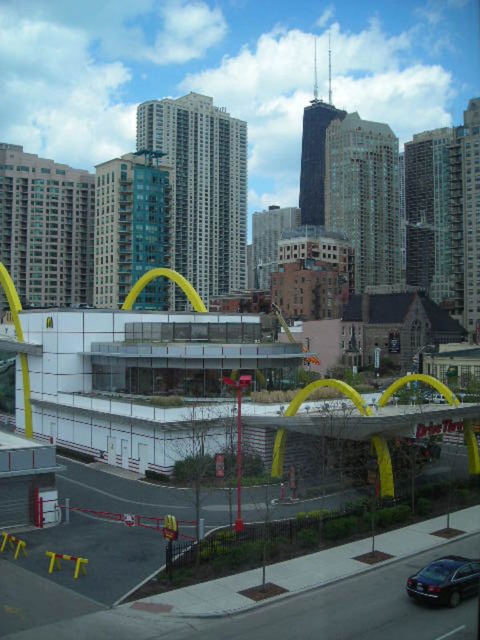
Does point (475, 586) come closer to viewer compared to point (177, 280)?

Yes, it is.

Consider the image. Which is more to the left, shiny black sedan at lower right or yellow rubber at center?

yellow rubber at center is more to the left.

Identify the location of shiny black sedan at lower right. This screenshot has height=640, width=480. (444, 580).

You are a GUI agent. You are given a task and a screenshot of the screen. Output one action in this format:
    pyautogui.click(x=<x>, y=<y>)
    Task: Click on the shiny black sedan at lower right
    The height and width of the screenshot is (640, 480).
    Given the screenshot: What is the action you would take?
    pyautogui.click(x=444, y=580)